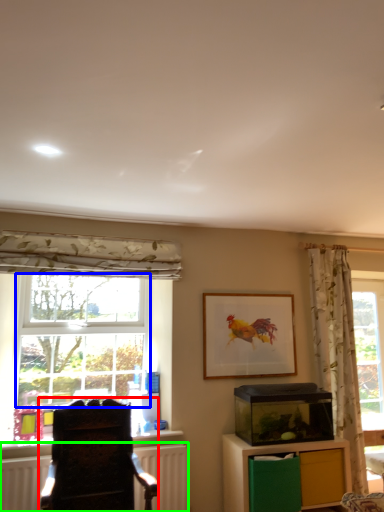
Question: Which object is the closest to the furniture (highlighted by a red box)? Choose among these: bay window (highlighted by a blue box) or radiator (highlighted by a green box).

Choices:
 (A) bay window
 (B) radiator

Answer: (B)